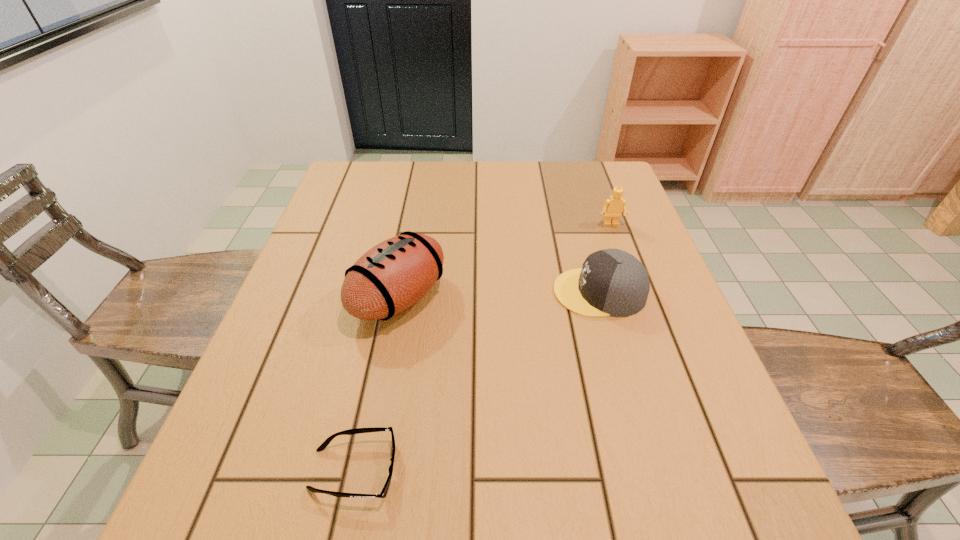
You are a GUI agent. You are given a task and a screenshot of the screen. Output one action in this format:
    pyautogui.click(x=<x>, y=<y>)
    Task: Click on the tallest object
    This screenshot has height=540, width=960.
    Given the screenshot: What is the action you would take?
    pyautogui.click(x=395, y=274)

At what (x,y) coordinates should I click in order to perform the action: click on the farthest object. Please return your answer as a coordinate pair (x, y). The image size is (960, 540). Looking at the image, I should click on (613, 207).

The width and height of the screenshot is (960, 540). Identify the location of the second tallest object. (613, 207).

Locate an element on the screen. This screenshot has height=540, width=960. cap is located at coordinates (611, 282).

At what (x,y) coordinates should I click in order to perform the action: click on the shortest object. Please return your answer as a coordinate pair (x, y). This screenshot has width=960, height=540. Looking at the image, I should click on (383, 493).

This screenshot has height=540, width=960. Identify the location of the nearest object. (383, 493).

Identify the location of free space located 0.300m on the front of the football (American). The height and width of the screenshot is (540, 960). (364, 484).

Where is `free space located 0.140m on the face of the Lego`? free space located 0.140m on the face of the Lego is located at coordinates (625, 262).

The height and width of the screenshot is (540, 960). I want to click on vacant space located 0.370m on the front-facing side of the second shortest object, so click(x=394, y=292).

Identify the location of vacant space positioned on the front-facing side of the second shortest object. The width and height of the screenshot is (960, 540). (471, 292).